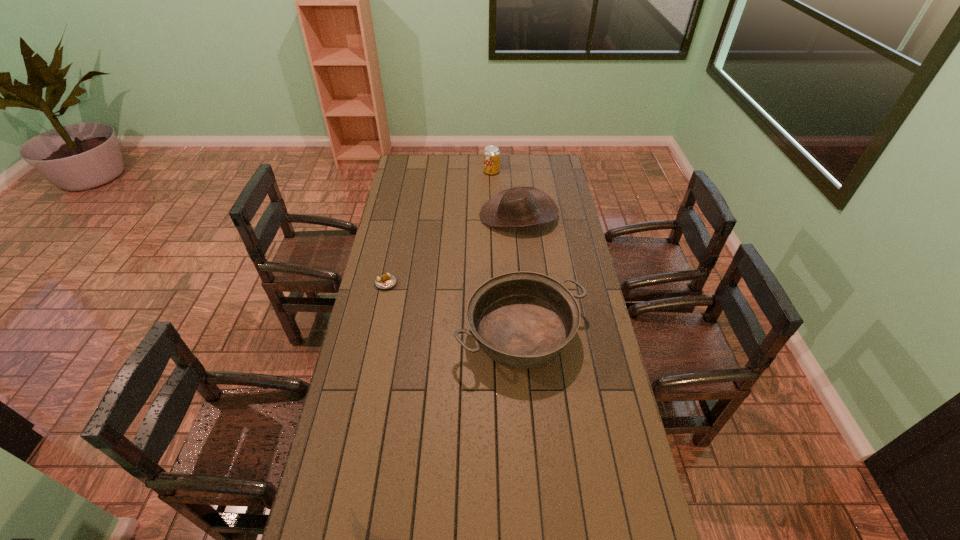
What are the coordinates of `object present at the left edge` in the screenshot? It's located at (385, 281).

Where is `cowboy hat at the right edge`? This screenshot has height=540, width=960. cowboy hat at the right edge is located at coordinates (520, 206).

The image size is (960, 540). In order to click on pan that is at the right edge in this screenshot , I will do `click(522, 320)`.

At what (x,y) coordinates should I click in order to perform the action: click on vacant region at the far edge of the desktop. Please return your answer as a coordinate pair (x, y). The height and width of the screenshot is (540, 960). Looking at the image, I should click on (471, 156).

At what (x,y) coordinates should I click in order to perform the action: click on free region at the left edge of the desktop. Please return your answer as a coordinate pair (x, y). This screenshot has width=960, height=540. Looking at the image, I should click on (393, 219).

Where is `vacant space at the right edge`? vacant space at the right edge is located at coordinates (576, 416).

The height and width of the screenshot is (540, 960). I want to click on free space between the nearest object and the leftmost object, so click(x=454, y=308).

The width and height of the screenshot is (960, 540). What are the coordinates of `vacant area that lies between the farthest object and the leftmost object` in the screenshot? It's located at (439, 227).

Find the location of `vacant point located between the cowboy hat and the shortest object`. vacant point located between the cowboy hat and the shortest object is located at coordinates pos(452,249).

Where is `free spot between the third nearest object and the pastry`? free spot between the third nearest object and the pastry is located at coordinates (452, 249).